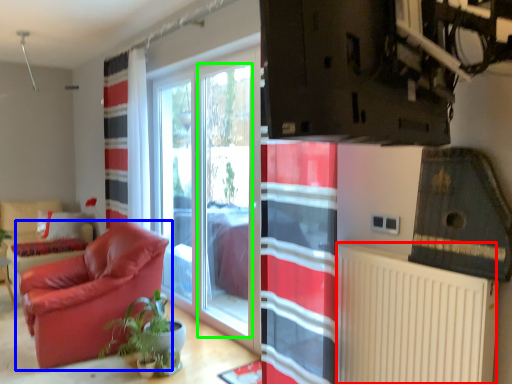
Question: Which object is positioned closest to radiator (highlighted by a red box)? Select from chair (highlighted by a blue box) and window screen (highlighted by a green box).

Choices:
 (A) chair
 (B) window screen

Answer: (B)